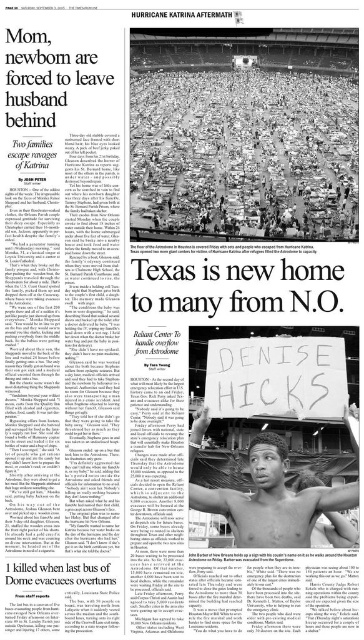
Question: Can you confirm if shiny metallic sign at center is positioned to the right of shiny black skin at center?

Choices:
 (A) yes
 (B) no

Answer: (A)

Question: In this image, where is white paper sign at center located relative to shiny black skin at center?

Choices:
 (A) right
 (B) left

Answer: (B)

Question: Which object is the farthest from the shiny black skin at center?

Choices:
 (A) white paper sign at center
 (B) shiny metallic sign at center

Answer: (B)

Question: Which is nearer to the white paper sign at center?

Choices:
 (A) shiny black skin at center
 (B) shiny metallic sign at center

Answer: (A)

Question: Is white paper sign at center positioned behind shiny black skin at center?

Choices:
 (A) no
 (B) yes

Answer: (B)

Question: Which object is positioned closest to the white paper sign at center?

Choices:
 (A) shiny black skin at center
 (B) shiny metallic sign at center

Answer: (A)